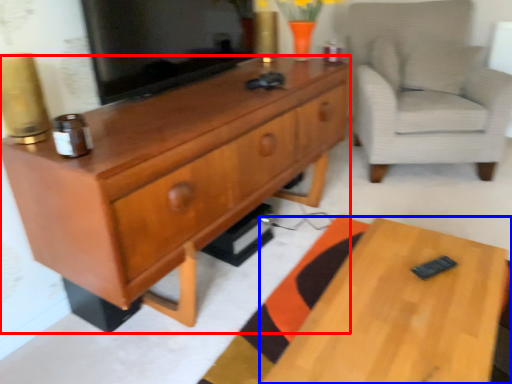
Question: Which object appears farthest to the camera in this image, cabinetry (highlighted by a red box) or desk (highlighted by a blue box)?

Choices:
 (A) cabinetry
 (B) desk

Answer: (A)